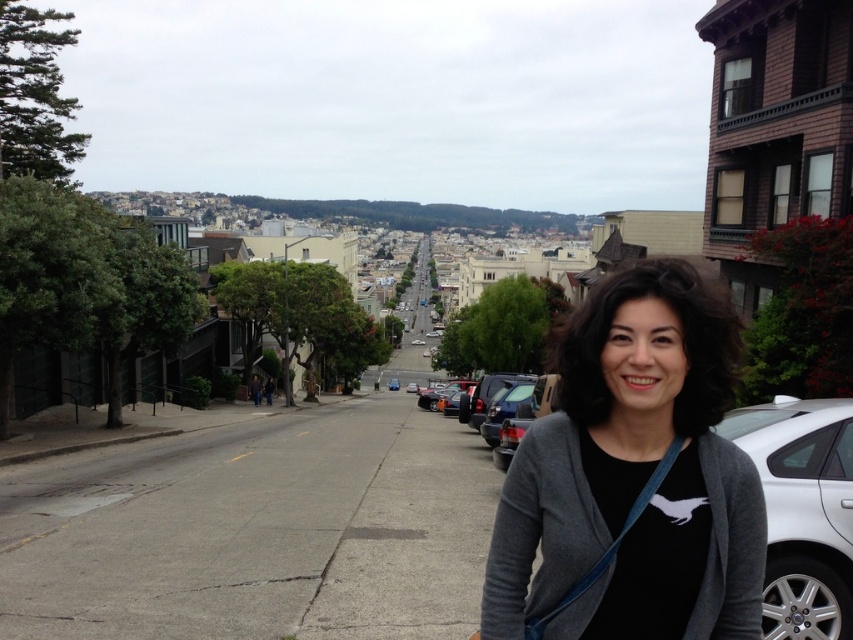
Can you confirm if gray fabric at center is bigger than white matte car at lower right?

Actually, gray fabric at center might be smaller than white matte car at lower right.

Can you confirm if gray fabric at center is positioned to the left of white matte car at lower right?

Yes, gray fabric at center is to the left of white matte car at lower right.

What do you see at coordinates (634, 476) in the screenshot? I see `gray fabric at center` at bounding box center [634, 476].

Find the location of a particular element. The width and height of the screenshot is (853, 640). gray fabric at center is located at coordinates (634, 476).